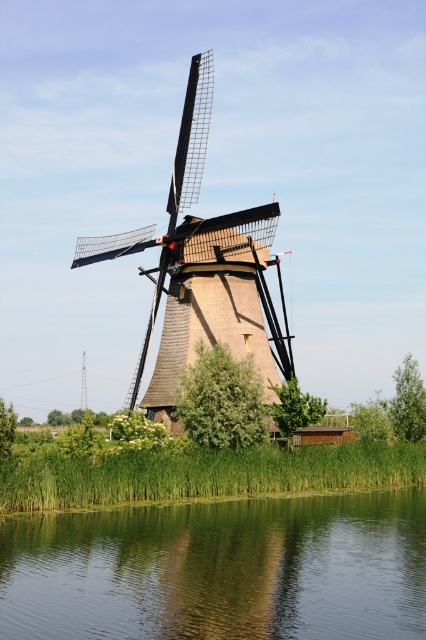
Question: Considering the real-world distances, which object is closest to the green grass at lower center?

Choices:
 (A) green smooth water at lower center
 (B) wooden windmill at center

Answer: (A)

Question: Which object appears farthest from the camera in this image?

Choices:
 (A) wooden windmill at center
 (B) green grass at lower center

Answer: (A)

Question: Can you confirm if wooden windmill at center is bigger than green grass at lower center?

Choices:
 (A) yes
 (B) no

Answer: (A)

Question: Is green smooth water at lower center in front of wooden windmill at center?

Choices:
 (A) yes
 (B) no

Answer: (A)

Question: Which of these objects is positioned closest to the green smooth water at lower center?

Choices:
 (A) wooden windmill at center
 (B) green grass at lower center

Answer: (B)

Question: Does wooden windmill at center have a greater width compared to green grass at lower center?

Choices:
 (A) no
 (B) yes

Answer: (A)